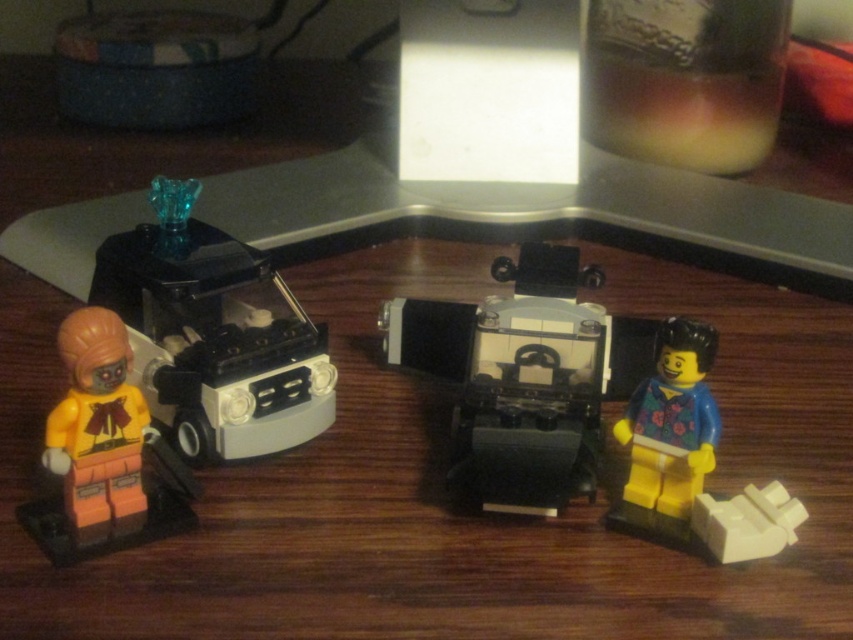
Does black plastic car at center have a greater width compared to matte black car at left?

Correct, the width of black plastic car at center exceeds that of matte black car at left.

Consider the image. Who is lower down, black plastic car at center or matte black car at left?

black plastic car at center is below.

Who is more distant from viewer, (543, 512) or (239, 456)?

Positioned behind is point (239, 456).

Locate an element on the screen. The image size is (853, 640). black plastic car at center is located at coordinates (524, 376).

Between orange matte minifigure at lower left and blue fabric minifigure at right, which one has less height?

orange matte minifigure at lower left

Can you confirm if orange matte minifigure at lower left is bigger than blue fabric minifigure at right?

Yes.

Describe the element at coordinates (103, 452) in the screenshot. I see `orange matte minifigure at lower left` at that location.

Locate an element on the screen. The height and width of the screenshot is (640, 853). orange matte minifigure at lower left is located at coordinates (103, 452).

Does black plastic car at center have a smaller size compared to floral-patterned plastic minifigure at lower right?

No.

Does black plastic car at center have a greater height compared to floral-patterned plastic minifigure at lower right?

Yes.

Is point (502, 278) closer to camera compared to point (648, 392)?

That is False.

You are a GUI agent. You are given a task and a screenshot of the screen. Output one action in this format:
    pyautogui.click(x=<x>, y=<y>)
    Task: Click on the black plastic car at center
    The image size is (853, 640).
    Given the screenshot: What is the action you would take?
    pyautogui.click(x=524, y=376)